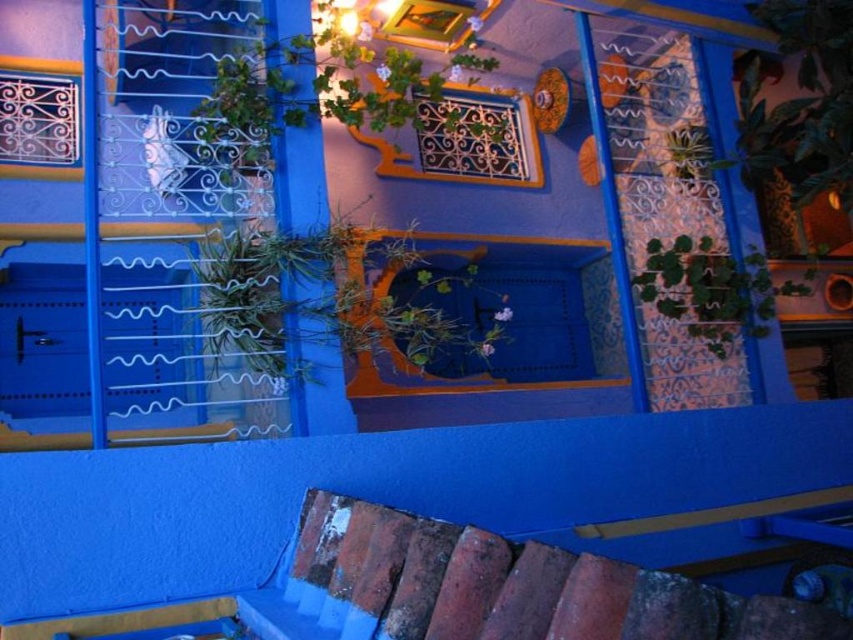
Question: Is green leafy plant at center further to the viewer compared to green leafy plant at upper center?

Choices:
 (A) yes
 (B) no

Answer: (B)

Question: Which object is closer to the camera taking this photo?

Choices:
 (A) green leafy plant at center
 (B) green leafy plant at upper right

Answer: (A)

Question: Among these objects, which one is farthest from the camera?

Choices:
 (A) green leafy plant at upper center
 (B) green leafy plant at upper right
 (C) green matte plant at upper right
 (D) green leafy plant at center

Answer: (B)

Question: Which point is farther to the camera?

Choices:
 (A) green leafy plant at upper right
 (B) green leafy plant at center
 (C) green matte plant at upper right
 (D) green leafy plant at upper center

Answer: (A)

Question: Does green leafy plant at center appear under green matte plant at upper right?

Choices:
 (A) yes
 (B) no

Answer: (A)

Question: Is green leafy plant at upper center positioned behind green leafy plant at upper right?

Choices:
 (A) no
 (B) yes

Answer: (A)